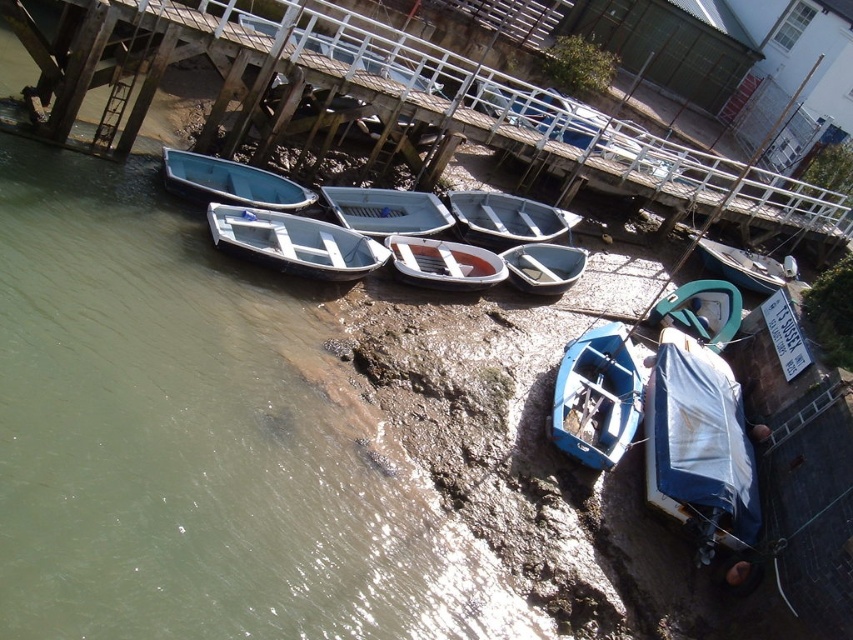
Question: Is blue matte boat at lower right further to camera compared to smooth white rowboat at upper left?

Choices:
 (A) yes
 (B) no

Answer: (B)

Question: Among these objects, which one is nearest to the camera?

Choices:
 (A) light blue wooden boat at center
 (B) white plastic canoe at center

Answer: (B)

Question: Is white plastic boat at center below matte gray dinghy at center?

Choices:
 (A) no
 (B) yes

Answer: (A)

Question: Which point appears closest to the camera in this image?

Choices:
 (A) (538, 221)
 (B) (492, 252)

Answer: (B)

Question: Is light blue wooden boat at center to the right of matte gray dinghy at center from the viewer's perspective?

Choices:
 (A) yes
 (B) no

Answer: (B)

Question: Among these points, which one is nearest to the camera?

Choices:
 (A) (471, 252)
 (B) (682, 296)
 (C) (404, 218)
 (D) (167, 148)

Answer: (D)